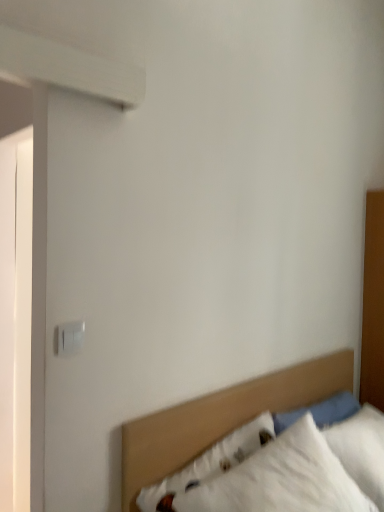
Question: Can you confirm if white plastic switch at upper left is smaller than white fabric bed at lower right?

Choices:
 (A) no
 (B) yes

Answer: (B)

Question: Is white plastic switch at upper left aimed at white fabric bed at lower right?

Choices:
 (A) yes
 (B) no

Answer: (B)

Question: Does white plastic switch at upper left have a lesser height compared to white fabric bed at lower right?

Choices:
 (A) no
 (B) yes

Answer: (B)

Question: Is white plastic switch at upper left looking in the opposite direction of white fabric bed at lower right?

Choices:
 (A) no
 (B) yes

Answer: (A)

Question: Is white plastic switch at upper left positioned far away from white fabric bed at lower right?

Choices:
 (A) yes
 (B) no

Answer: (B)

Question: Is white plastic switch at upper left positioned before white fabric bed at lower right?

Choices:
 (A) yes
 (B) no

Answer: (B)

Question: From the image's perspective, would you say white fabric bed at lower right is positioned over white plastic switch at upper left?

Choices:
 (A) yes
 (B) no

Answer: (B)

Question: Is white fabric bed at lower right wider than white plastic switch at upper left?

Choices:
 (A) no
 (B) yes

Answer: (B)

Question: Considering the relative sizes of white fabric bed at lower right and white plastic switch at upper left in the image provided, is white fabric bed at lower right thinner than white plastic switch at upper left?

Choices:
 (A) no
 (B) yes

Answer: (A)

Question: Would you say white plastic switch at upper left is part of white fabric bed at lower right's contents?

Choices:
 (A) yes
 (B) no

Answer: (B)

Question: From the image's perspective, is white fabric bed at lower right under white plastic switch at upper left?

Choices:
 (A) no
 (B) yes

Answer: (B)

Question: Are white fabric bed at lower right and white plastic switch at upper left located far from each other?

Choices:
 (A) yes
 (B) no

Answer: (B)

Question: Visually, is white plastic switch at upper left positioned to the left or to the right of white fabric bed at lower right?

Choices:
 (A) left
 (B) right

Answer: (A)